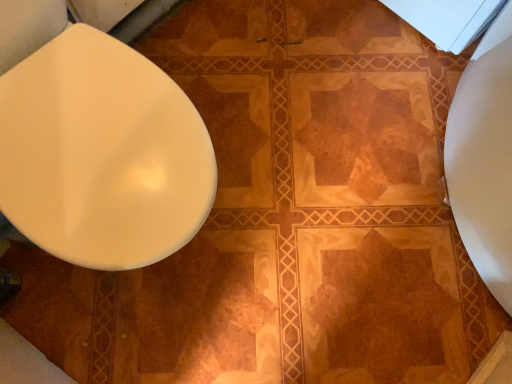
Describe the element at coordinates (102, 154) in the screenshot. I see `matte white toilet at left` at that location.

Identify the location of matte white toilet at left. (102, 154).

This screenshot has width=512, height=384. In order to click on matte white toilet at left in this screenshot , I will do `click(102, 154)`.